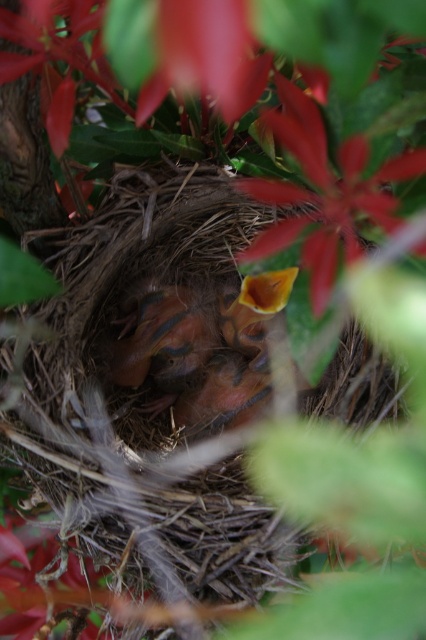
Does orange smooth beak at center have a lesser width compared to smooth yellow petal at center?

No.

Does orange smooth beak at center have a greater width compared to smooth yellow petal at center?

Yes, orange smooth beak at center is wider than smooth yellow petal at center.

Consider the image. Who is more forward, [143,333] or [313,172]?

Point [313,172] is in front.

Where is `orange smooth beak at center`? This screenshot has height=640, width=426. orange smooth beak at center is located at coordinates coord(203,349).